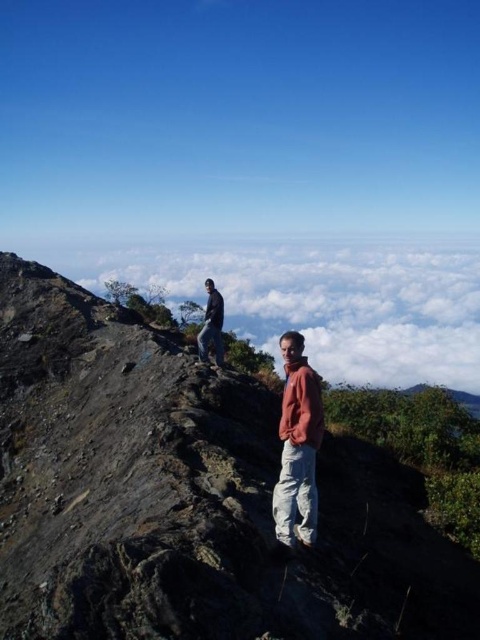
Does rugged rock mountain at center have a lesser width compared to matte orange jacket at center?

Result: In fact, rugged rock mountain at center might be wider than matte orange jacket at center.

Who is more distant from viewer, (60, 413) or (300, 486)?

The point (60, 413) is more distant.

The image size is (480, 640). Find the location of `rugged rock mountain at center`. rugged rock mountain at center is located at coordinates (187, 497).

Does point (292, 353) come behind point (220, 328)?

That is False.

Can you confirm if matte orange jacket at center is positioned to the left of dark blue jacket at upper left?

No, matte orange jacket at center is not to the left of dark blue jacket at upper left.

Is point (303, 470) less distant than point (216, 291)?

That is True.

Where is `matte orange jacket at center`? The height and width of the screenshot is (640, 480). matte orange jacket at center is located at coordinates (298, 445).

Is rugged rock mountain at center further to camera compared to dark blue jacket at upper left?

No, it is not.

Who is positioned more to the right, rugged rock mountain at center or dark blue jacket at upper left?

From the viewer's perspective, dark blue jacket at upper left appears more on the right side.

Is point (182, 372) less distant than point (207, 323)?

That is True.

The image size is (480, 640). Identify the location of rugged rock mountain at center. (187, 497).